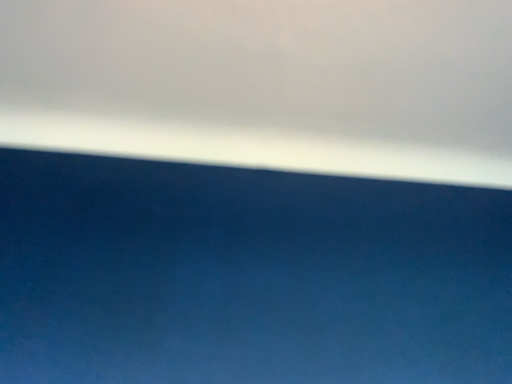
You are a GUI agent. You are given a task and a screenshot of the screen. Output one action in this format:
    pyautogui.click(x=<x>, y=<y>)
    Task: Click on the white matte cloud at upper center
    The width and height of the screenshot is (512, 384).
    Given the screenshot: What is the action you would take?
    pyautogui.click(x=267, y=83)

The image size is (512, 384). What do you see at coordinates (267, 83) in the screenshot?
I see `white matte cloud at upper center` at bounding box center [267, 83].

In order to face white matte cloud at upper center, should I rotate leftwards or rightwards?

You should rotate right by 2.829 degrees.

Identify the location of white matte cloud at upper center. (267, 83).